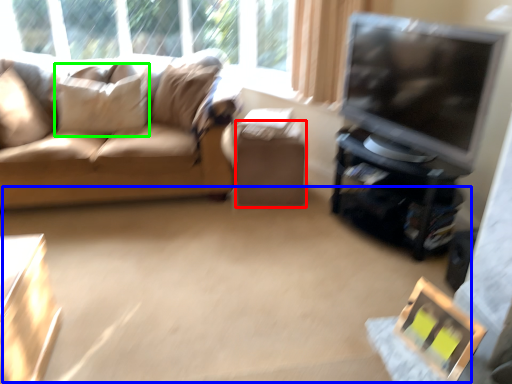
Question: Which is nearer to the table (highlighted by a red box)? plain (highlighted by a blue box) or pillow (highlighted by a green box).

Choices:
 (A) plain
 (B) pillow

Answer: (A)